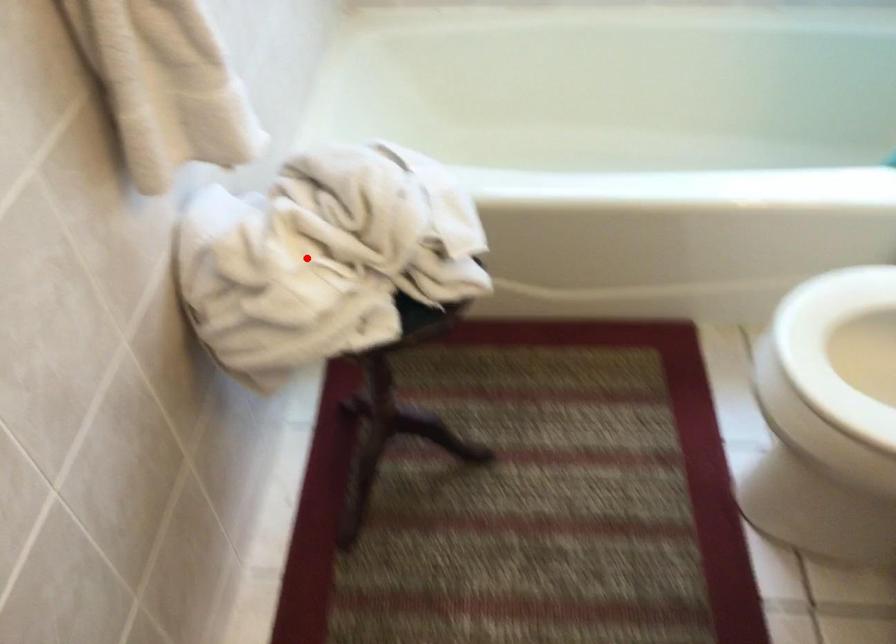
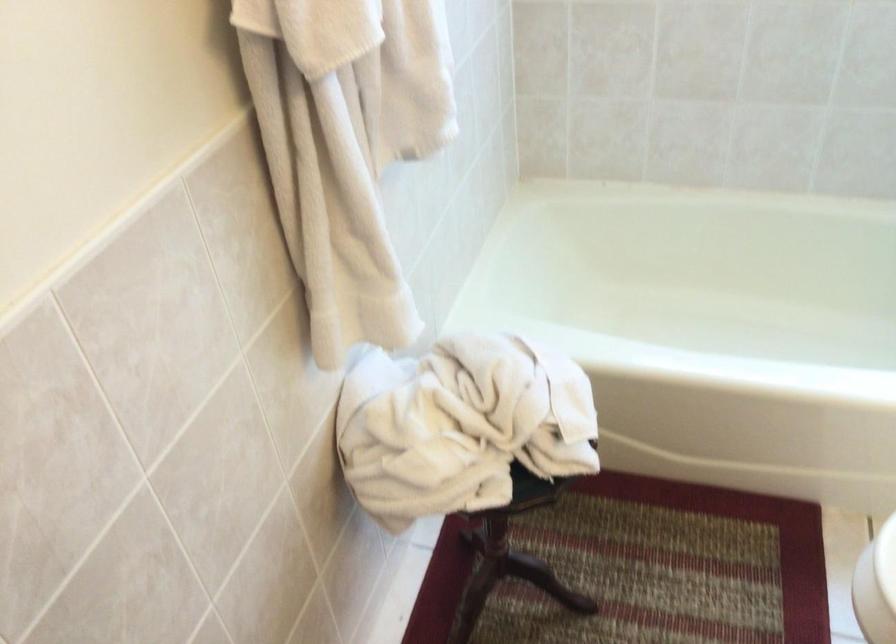
Locate, in the second image, the point that corresponds to the highlighted location in the first image.

(440, 431)